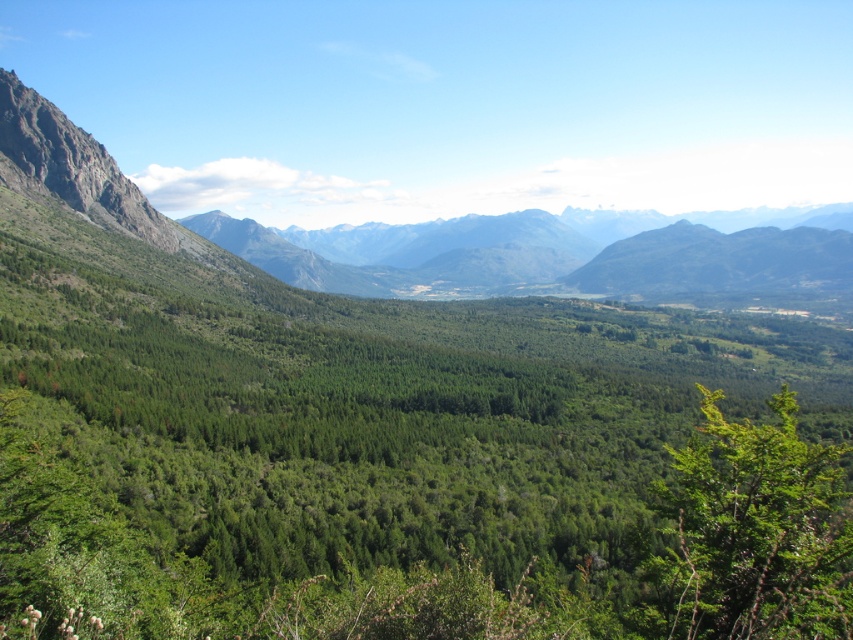
Is green forested mountain at left positioned before green forested mountain range at center?

That is True.

I want to click on green forested mountain at left, so click(x=549, y=257).

Who is more forward, (733, 618) or (387, 243)?

Point (733, 618)

This screenshot has height=640, width=853. I want to click on green leafy tree at lower right, so click(752, 532).

Is point (514, 253) positioned after point (763, 531)?

Yes, point (514, 253) is behind point (763, 531).

I want to click on green forested mountain at left, so click(549, 257).